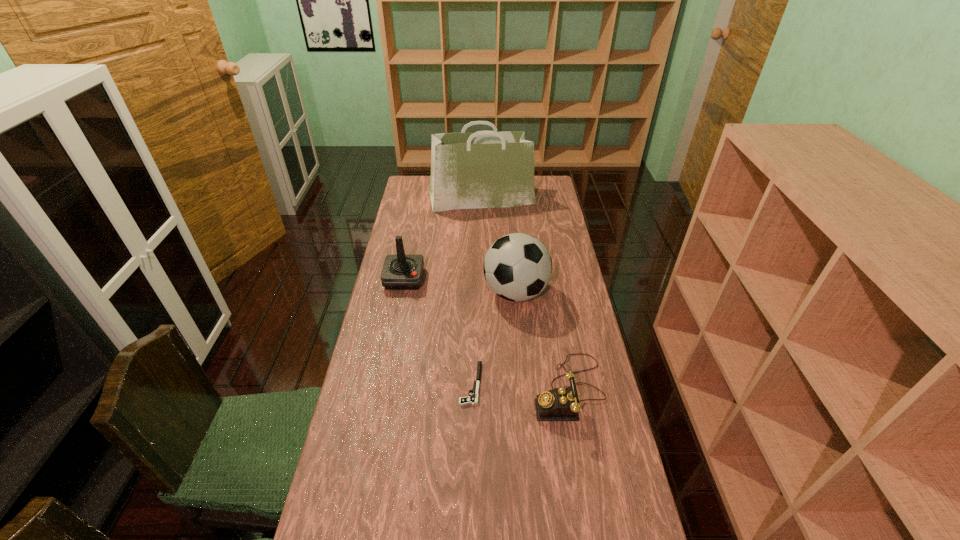
Where is `vacant space located on the dial of the telephone`? The width and height of the screenshot is (960, 540). vacant space located on the dial of the telephone is located at coordinates (413, 390).

Where is `free space located 0.060m on the dial of the telephone`? The image size is (960, 540). free space located 0.060m on the dial of the telephone is located at coordinates (513, 390).

The width and height of the screenshot is (960, 540). In order to click on free point located on the front-facing side of the shortest object in this screenshot , I will do [371, 384].

Find the location of a particular element. This screenshot has height=540, width=960. free space located on the front-facing side of the shortest object is located at coordinates (391, 384).

Locate an element on the screen. vacant region located 0.200m on the front-facing side of the shortest object is located at coordinates (394, 384).

At what (x,y) coordinates should I click in order to perform the action: click on object that is at the far edge. Please return your answer as a coordinate pair (x, y). Looking at the image, I should click on (487, 169).

You are a GUI agent. You are given a task and a screenshot of the screen. Output one action in this format:
    pyautogui.click(x=<x>, y=<y>)
    Task: Click on the grocery bag situated at the left edge
    This screenshot has width=960, height=540.
    Given the screenshot: What is the action you would take?
    pyautogui.click(x=487, y=169)

Image resolution: width=960 pixels, height=540 pixels. I want to click on joystick located in the left edge section of the desktop, so coord(400,272).

Locate an element on the screen. grocery bag present at the right edge is located at coordinates (487, 169).

Locate an element on the screen. This screenshot has height=540, width=960. soccer ball present at the right edge is located at coordinates (x=517, y=267).